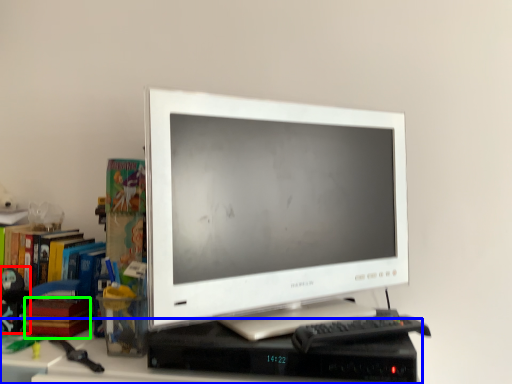
Question: Based on their relative distances, which object is nearer to toy (highlighted by a red box)? Choose from computer desk (highlighted by a blue box) and paperback book (highlighted by a green box).

Choices:
 (A) computer desk
 (B) paperback book

Answer: (B)